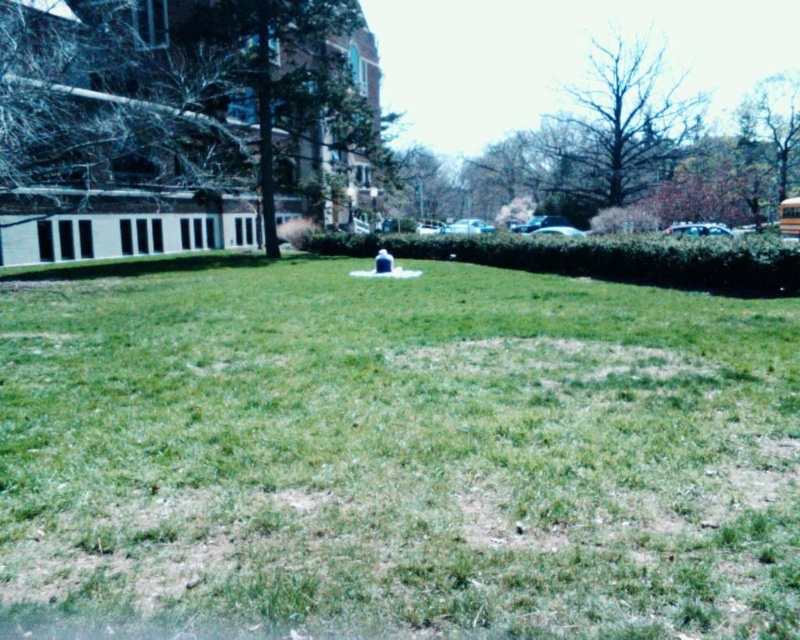
Question: Is green grassy at center above yellow matte school bus at right?

Choices:
 (A) yes
 (B) no

Answer: (B)

Question: In this image, where is green grassy at center located relative to yellow matte school bus at right?

Choices:
 (A) left
 (B) right

Answer: (A)

Question: Which point is farther to the camera?

Choices:
 (A) (792, 230)
 (B) (346, 435)

Answer: (A)

Question: Is green grassy at center positioned in front of yellow matte school bus at right?

Choices:
 (A) yes
 (B) no

Answer: (A)

Question: Which of the following is the closest to the observer?

Choices:
 (A) (782, 198)
 (B) (112, 481)

Answer: (B)

Question: Which object is farther from the camera taking this photo?

Choices:
 (A) green grassy at center
 (B) yellow matte school bus at right

Answer: (B)